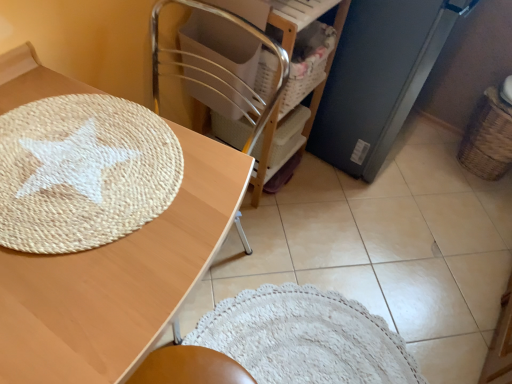
Locate an element on the screen. This screenshot has width=512, height=384. natural wood table at upper left is located at coordinates pyautogui.click(x=118, y=281).

The height and width of the screenshot is (384, 512). In order to click on wooden chair at center in this screenshot , I will do `click(238, 48)`.

At what (x,y) coordinates should I click in order to perform the action: click on woven brown basket at right. Please return your answer as a coordinate pair (x, y). Looking at the image, I should click on (488, 138).

From the image's perspective, does wooden chair at center appear higher than natural wood table at upper left?

Correct, wooden chair at center appears higher than natural wood table at upper left in the image.

Which object is further away from the camera, wooden chair at center or natural wood table at upper left?

wooden chair at center is behind.

From a real-world perspective, who is located lower, wooden chair at center or natural wood table at upper left?

In real-world perspective, wooden chair at center is lower.

Considering the relative sizes of woven brown basket at right and natural wood table at upper left in the image provided, is woven brown basket at right bigger than natural wood table at upper left?

No.

Considering the sizes of objects woven brown basket at right and natural wood table at upper left in the image provided, who is shorter, woven brown basket at right or natural wood table at upper left?

woven brown basket at right is shorter.

Considering the sizes of objects woven brown basket at right and natural wood table at upper left in the image provided, who is wider, woven brown basket at right or natural wood table at upper left?

natural wood table at upper left is wider.

Which object is positioned more to the left, woven brown basket at right or natural wood table at upper left?

Positioned to the left is natural wood table at upper left.

Can we say matte black refrigerator at right lies outside wooden chair at center?

Indeed, matte black refrigerator at right is completely outside wooden chair at center.

In the scene shown: Is matte black refrigerator at right positioned far away from wooden chair at center?

No, matte black refrigerator at right is not far from wooden chair at center.

You are a GUI agent. You are given a task and a screenshot of the screen. Output one action in this format:
    pyautogui.click(x=<x>, y=<y>)
    Task: Click on the appliance above the wooden chair at center (from a real-world perspective)
    
    Given the screenshot: What is the action you would take?
    pyautogui.click(x=378, y=78)

How different are the orientations of natural wood table at upper left and matte black refrigerator at right in degrees?

The angle between the facing direction of natural wood table at upper left and the facing direction of matte black refrigerator at right is 0.00786 degrees.

Are natural wood table at upper left and matte black refrigerator at right beside each other?

No.

At what (x,y) coordinates should I click in order to perform the action: click on table below the matte black refrigerator at right (from a real-world perspective). Please return your answer as a coordinate pair (x, y). Looking at the image, I should click on (118, 281).

Is point (195, 139) in front of point (405, 44)?

That is True.

From a real-world perspective, which object rests below the other?

natural wood table at upper left is physically lower.

Looking at their sizes, would you say matte black refrigerator at right is wider or thinner than natural wood table at upper left?

In the image, matte black refrigerator at right appears to be more narrow than natural wood table at upper left.

Considering the points (392, 30) and (32, 58), which point is behind, point (392, 30) or point (32, 58)?

The point (392, 30) is behind.

Looking at this image, from the image's perspective, is matte black refrigerator at right above or below natural wood table at upper left?

Clearly, from the image's perspective, matte black refrigerator at right is above natural wood table at upper left.

Who is smaller, wooden chair at center or matte black refrigerator at right?

With smaller size is wooden chair at center.

Is wooden chair at center wider or thinner than matte black refrigerator at right?

wooden chair at center is thinner than matte black refrigerator at right.

In terms of height, does wooden chair at center look taller or shorter compared to matte black refrigerator at right?

In the image, wooden chair at center appears to be shorter than matte black refrigerator at right.

From the picture: From the image's perspective, is wooden chair at center below matte black refrigerator at right?

Indeed, from the image's perspective, wooden chair at center is shown beneath matte black refrigerator at right.

Is natural wood table at upper left oriented towards woven brown basket at right?

No, natural wood table at upper left is not turned towards woven brown basket at right.

How far apart are natural wood table at upper left and woven brown basket at right?

They are 1.55 meters apart.

Between natural wood table at upper left and woven brown basket at right, which one has smaller width?

woven brown basket at right.

Which of these two, natural wood table at upper left or woven brown basket at right, stands taller?

With more height is natural wood table at upper left.

Where is `furniture that is on the right side of natural wood table at upper left`? furniture that is on the right side of natural wood table at upper left is located at coordinates (238, 48).

This screenshot has width=512, height=384. In the image, there is a natural wood table at upper left. Identify the location of basket above it (from the image's perspective). (488, 138).

When comparing their distances from wooden chair at center, does matte black refrigerator at right or woven brown basket at right seem further?

woven brown basket at right.

Considering their positions, is natural wood table at upper left positioned closer to woven brown basket at right than wooden chair at center?

wooden chair at center is positioned closer to the anchor woven brown basket at right.

Estimate the real-world distances between objects in this image. Which object is further from natural wood table at upper left, matte black refrigerator at right or wooden chair at center?

matte black refrigerator at right is positioned further to the anchor natural wood table at upper left.

Estimate the real-world distances between objects in this image. Which object is closer to woven brown basket at right, wooden chair at center or matte black refrigerator at right?

matte black refrigerator at right is positioned closer to the anchor woven brown basket at right.

When comparing their distances from natural wood table at upper left, does wooden chair at center or woven brown basket at right seem further?

woven brown basket at right is positioned further to the anchor natural wood table at upper left.

From the picture: From the image, which object appears to be nearer to natural wood table at upper left, matte black refrigerator at right or woven brown basket at right?

matte black refrigerator at right is positioned closer to the anchor natural wood table at upper left.

In the scene shown: When comparing their distances from natural wood table at upper left, does wooden chair at center or matte black refrigerator at right seem closer?

wooden chair at center is closer to natural wood table at upper left.

Looking at the image, which one is located further to wooden chair at center, natural wood table at upper left or matte black refrigerator at right?

natural wood table at upper left.

Where is `furniture between natural wood table at upper left and woven brown basket at right`? This screenshot has height=384, width=512. furniture between natural wood table at upper left and woven brown basket at right is located at coordinates (238, 48).

This screenshot has width=512, height=384. I want to click on appliance between natural wood table at upper left and woven brown basket at right in the horizontal direction, so click(x=378, y=78).

Locate an element on the screen. This screenshot has width=512, height=384. furniture situated between natural wood table at upper left and matte black refrigerator at right from left to right is located at coordinates (238, 48).

Locate an element on the screen. appliance situated between wooden chair at center and woven brown basket at right from left to right is located at coordinates (378, 78).